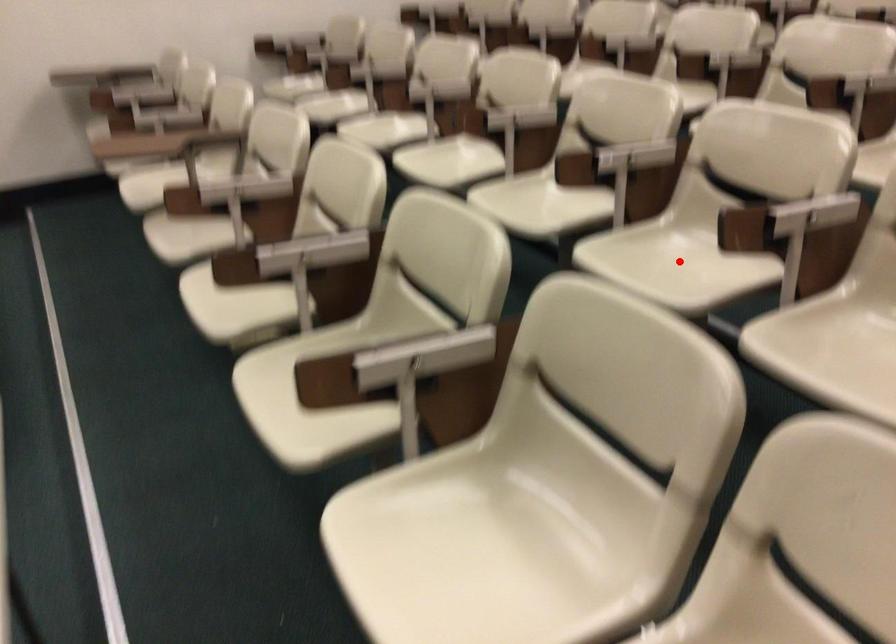
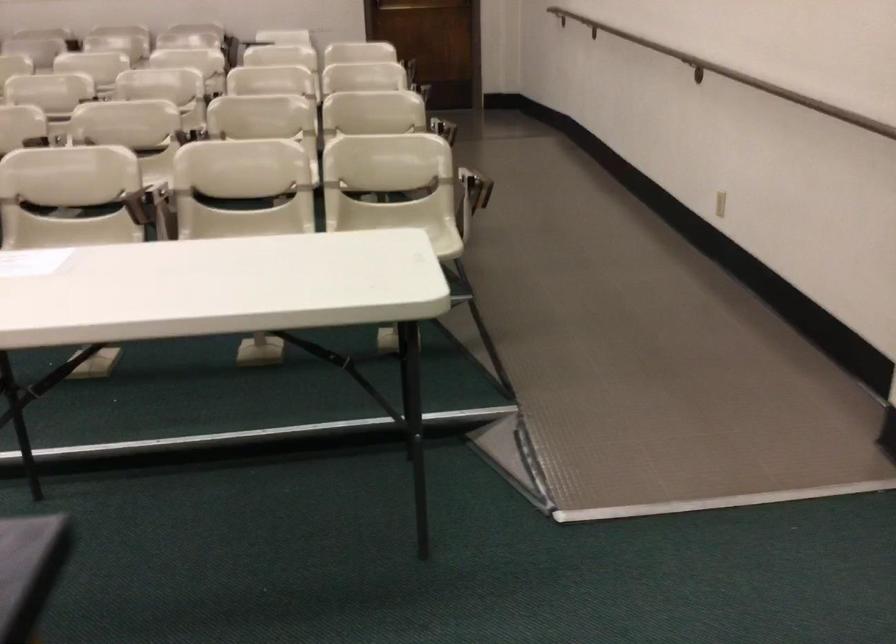
Question: I am providing you with two images of the same scene from different viewpoints. A red point is marked on the first image. Can you still see the location of the red point in image 2?

Choices:
 (A) Yes
 (B) No

Answer: (B)